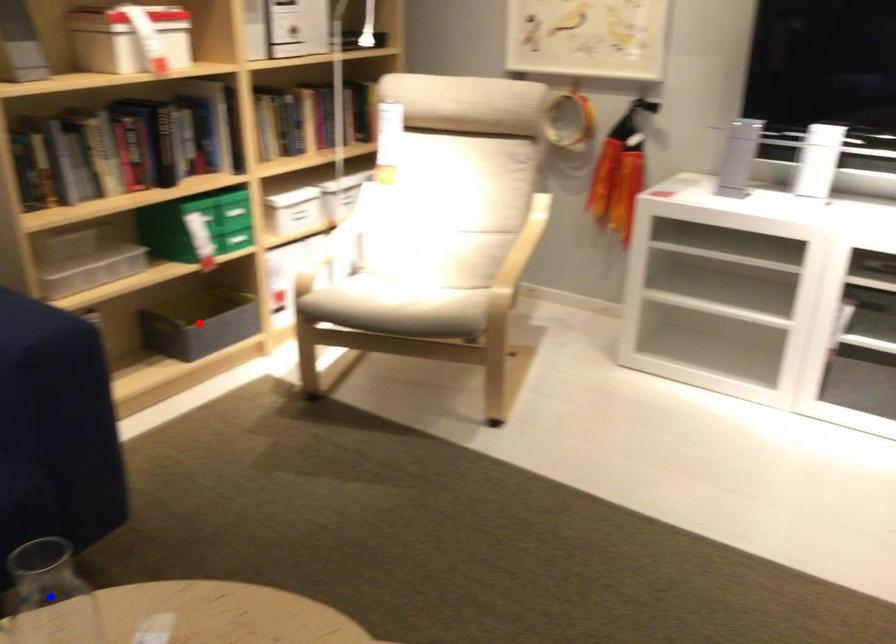
Question: Which of the two points in the image is closer to the camera?

Choices:
 (A) Blue point is closer.
 (B) Red point is closer.

Answer: (A)